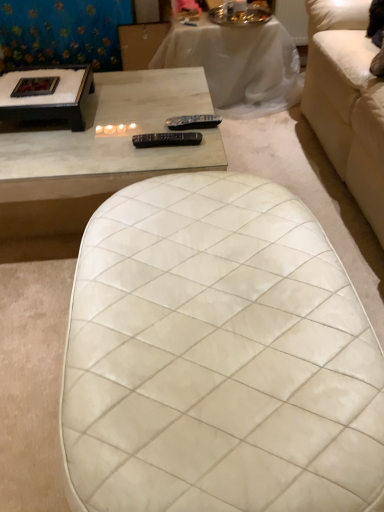
This screenshot has height=512, width=384. Find the location of `vacant space situated above white marble coffee table at upper left, acting as the first coffee table starting from the right (from a real-world perspective)`. vacant space situated above white marble coffee table at upper left, acting as the first coffee table starting from the right (from a real-world perspective) is located at coordinates click(110, 117).